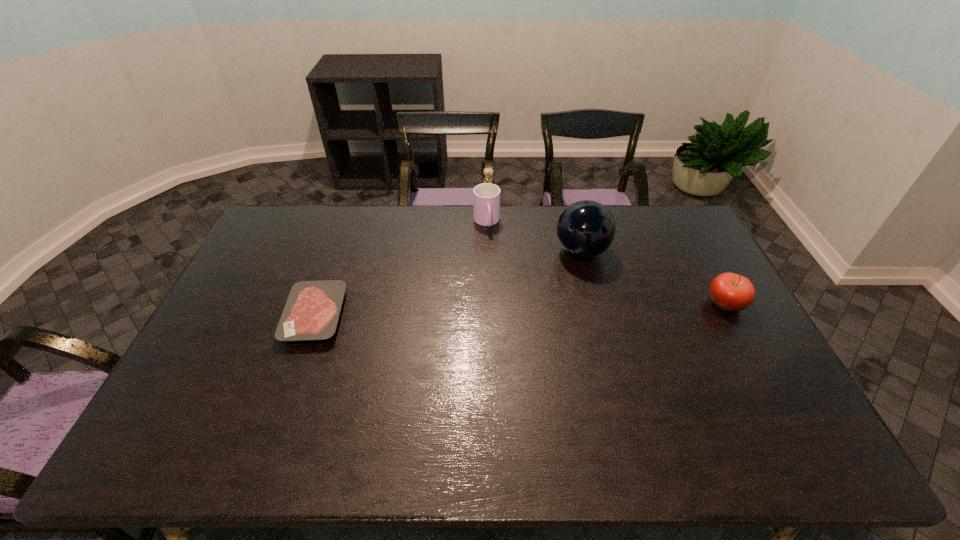
You are a GUI agent. You are given a task and a screenshot of the screen. Output one action in this format:
    pyautogui.click(x=<x>, y=<y>)
    Task: Click on the free space that is in between the bowling ball and the third object from right to left
    Image resolution: width=960 pixels, height=540 pixels.
    Given the screenshot: What is the action you would take?
    pyautogui.click(x=534, y=237)

Locate an element on the screen. The image size is (960, 540). free space that is in between the second object from left to right and the leftmost object is located at coordinates (401, 269).

Locate an element on the screen. The width and height of the screenshot is (960, 540). vacant area between the cup and the tallest object is located at coordinates (534, 237).

Locate an element on the screen. The height and width of the screenshot is (540, 960). object that ranks as the closest to the rightmost object is located at coordinates (585, 229).

Identify which object is the nearest to the rightmost object. Please provide its 2D coordinates. Your answer should be formatted as a tuple, i.e. [(x, y)], where the tuple contains the x and y coordinates of a point satisfying the conditions above.

[(585, 229)]

This screenshot has width=960, height=540. In order to click on free space that satisfies the following two spatial constraints: 1. on the back side of the cup; 2. on the right side of the steak in this screenshot , I will do `click(348, 222)`.